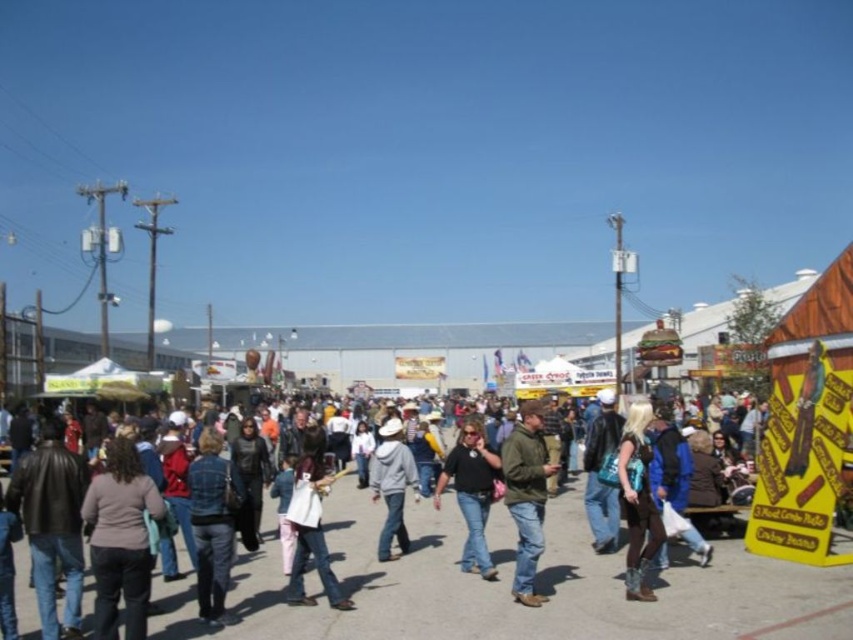
Question: Which point is closer to the camera?

Choices:
 (A) gray hoodie at center
 (B) dark brown leather jacket at lower left
 (C) denim jacket at lower left
 (D) denim jacket at center

Answer: (B)

Question: Which point appears farthest from the camera in this image?

Choices:
 (A) (206, 448)
 (B) (305, 561)
 (C) (466, 593)

Answer: (A)

Question: Does dark brown leather jacket at lower left have a greater width compared to gray hoodie at center?

Choices:
 (A) no
 (B) yes

Answer: (B)

Question: Can you confirm if teal fabric purse at lower right is positioned below white cotton jacket at center?

Choices:
 (A) yes
 (B) no

Answer: (A)

Question: Is dark brown leather jacket at lower left positioned in front of green matte jacket at center?

Choices:
 (A) no
 (B) yes

Answer: (B)

Question: Which of the following is the farthest from the observer?

Choices:
 (A) dark brown leather jacket at lower left
 (B) denim jacket at lower left
 (C) white cotton jacket at center

Answer: (C)